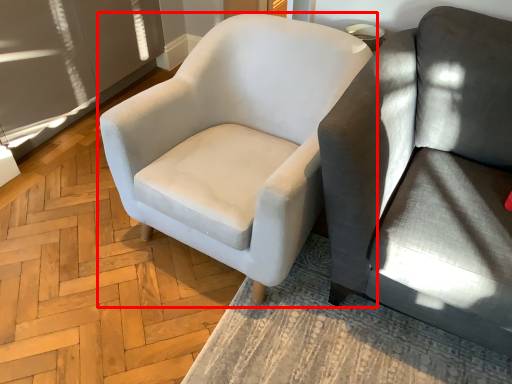
Question: From the image's perspective, what is the correct spatial relationship of chair (annotated by the red box) in relation to studio couch?

Choices:
 (A) below
 (B) above

Answer: (B)